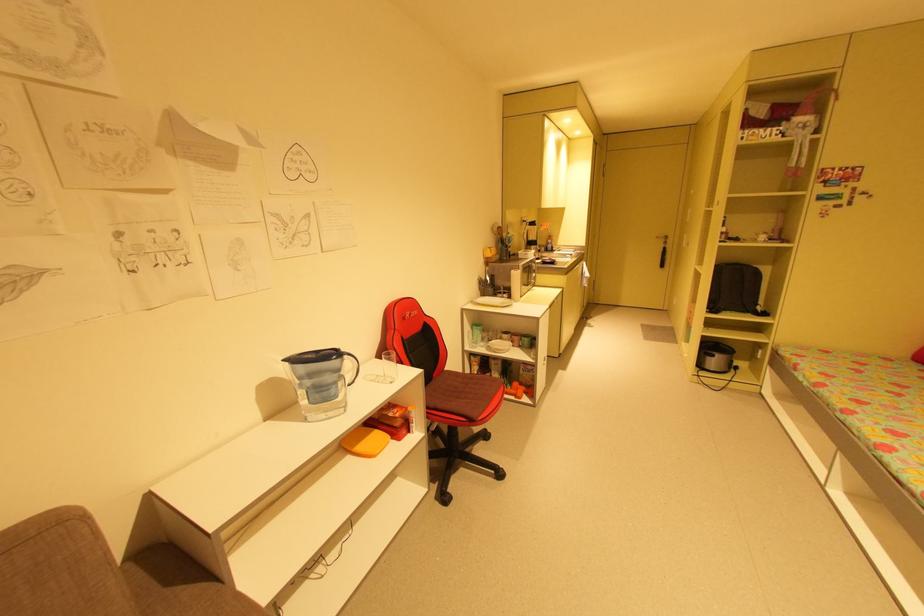
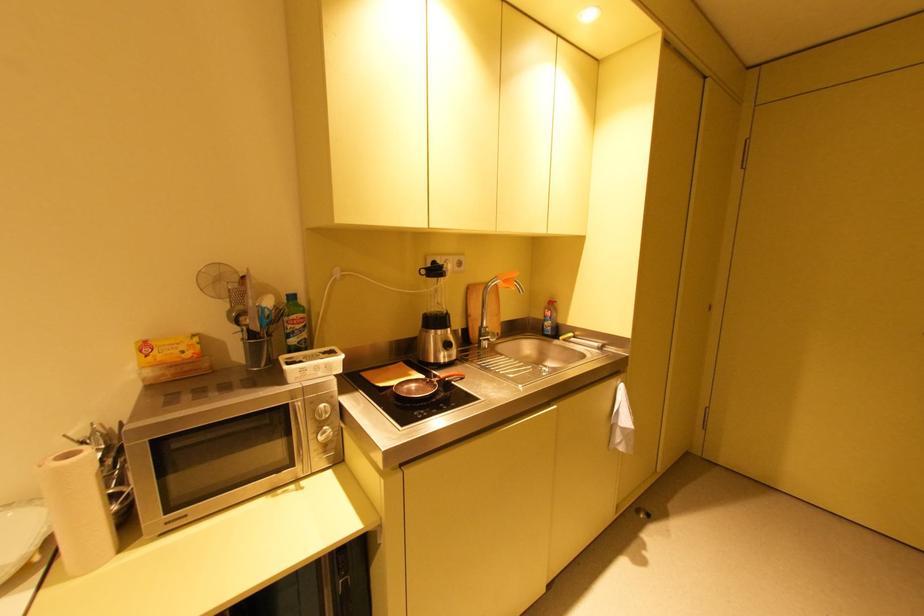
Where in the second image is the point corresponding to the point at 540,246 from the first image?

(444, 331)